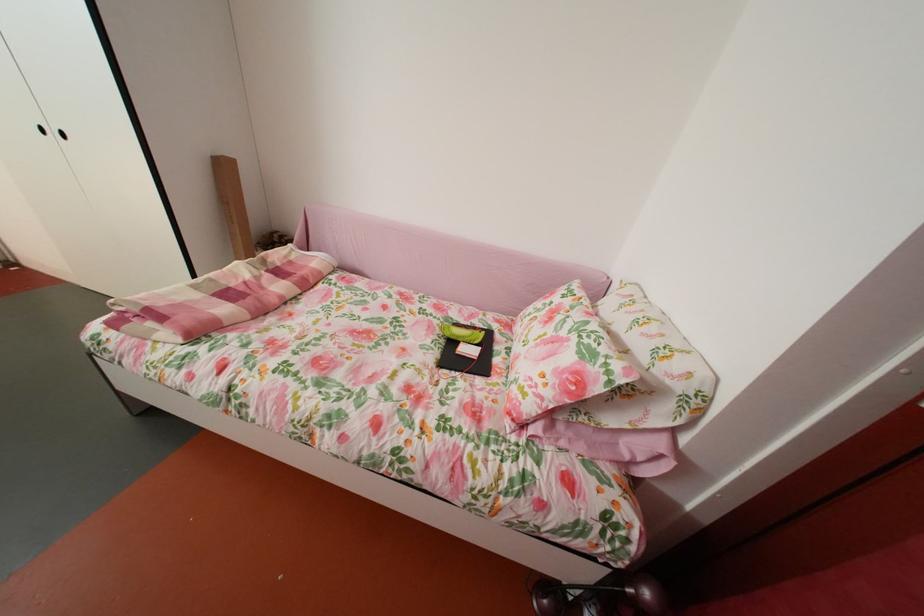
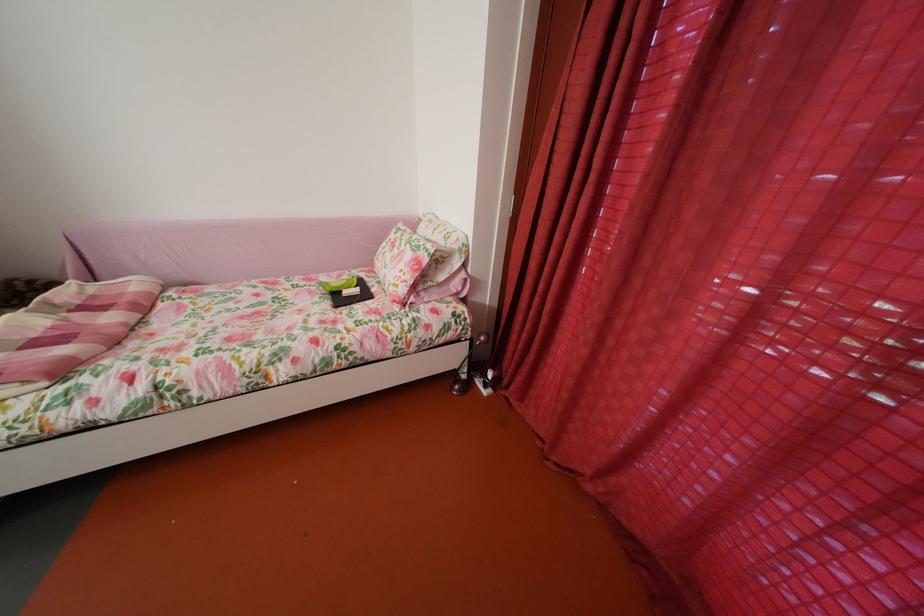
In the second image, find the point that corresponds to point (458, 341) in the first image.

(341, 296)